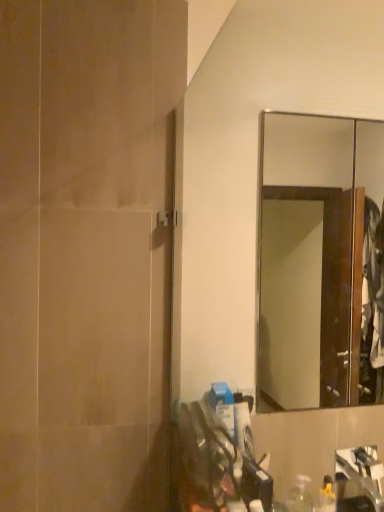
Question: From a real-world perspective, relative to wooden-framed mirror at upper right, is matte beige screen door at left vertically above or below?

Choices:
 (A) above
 (B) below

Answer: (A)

Question: Based on their positions, is matte beige screen door at left located to the left or right of wooden-framed mirror at upper right?

Choices:
 (A) left
 (B) right

Answer: (A)

Question: In terms of width, does matte beige screen door at left look wider or thinner when compared to wooden-framed mirror at upper right?

Choices:
 (A) thin
 (B) wide

Answer: (A)

Question: In terms of width, does wooden-framed mirror at upper right look wider or thinner when compared to matte beige screen door at left?

Choices:
 (A) wide
 (B) thin

Answer: (A)

Question: Based on their sizes in the image, would you say wooden-framed mirror at upper right is bigger or smaller than matte beige screen door at left?

Choices:
 (A) big
 (B) small

Answer: (B)

Question: In the image, is wooden-framed mirror at upper right on the left side or the right side of matte beige screen door at left?

Choices:
 (A) left
 (B) right

Answer: (B)

Question: Is wooden-framed mirror at upper right taller or shorter than matte beige screen door at left?

Choices:
 (A) tall
 (B) short

Answer: (B)